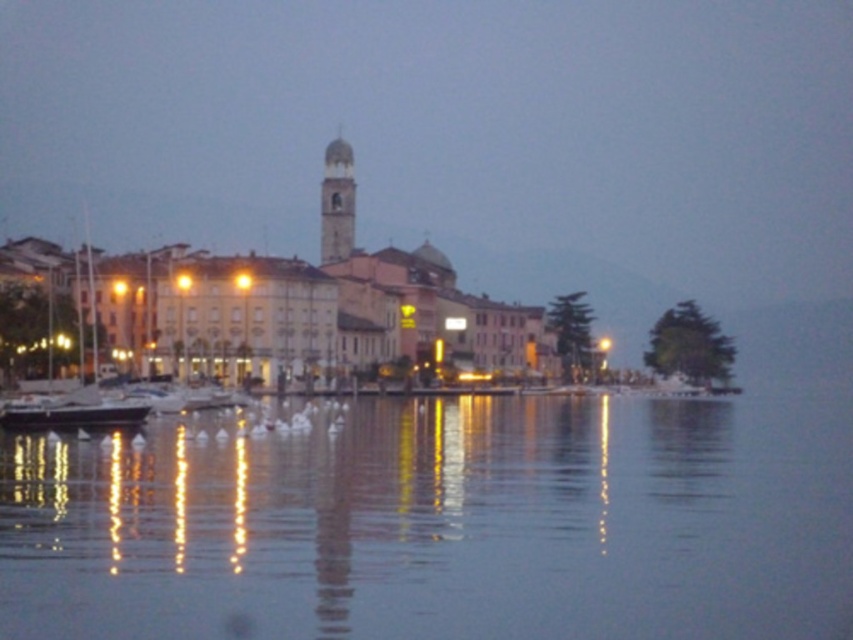
In the scene shown: Does black matte boat at lower left have a greater height compared to smooth stone bell tower at center?

No, black matte boat at lower left is not taller than smooth stone bell tower at center.

Between black matte boat at lower left and smooth stone bell tower at center, which one is positioned lower?

Positioned lower is black matte boat at lower left.

Who is more distant from viewer, (74, 408) or (331, 196)?

The point (331, 196) is behind.

You are a GUI agent. You are given a task and a screenshot of the screen. Output one action in this format:
    pyautogui.click(x=<x>, y=<y>)
    Task: Click on the black matte boat at lower left
    
    Given the screenshot: What is the action you would take?
    pyautogui.click(x=73, y=412)

How far apart are transparent water at center and white matte sailboat at left?

139.15 feet

Is transparent water at center taller than white matte sailboat at left?

Incorrect, transparent water at center's height is not larger of white matte sailboat at left's.

Between point (506, 584) and point (4, 410), which one is positioned behind?

The point (4, 410) is behind.

Find the location of a particular element. transparent water at center is located at coordinates (444, 524).

Between point (134, 358) and point (351, 177), which one is positioned in front?

Point (134, 358) is in front.

Is white matte sailboat at left above smooth stone bell tower at center?

No, white matte sailboat at left is not above smooth stone bell tower at center.

This screenshot has height=640, width=853. What do you see at coordinates (84, 332) in the screenshot? I see `white matte sailboat at left` at bounding box center [84, 332].

Find the location of a particular element. This screenshot has height=640, width=853. white matte sailboat at left is located at coordinates (84, 332).